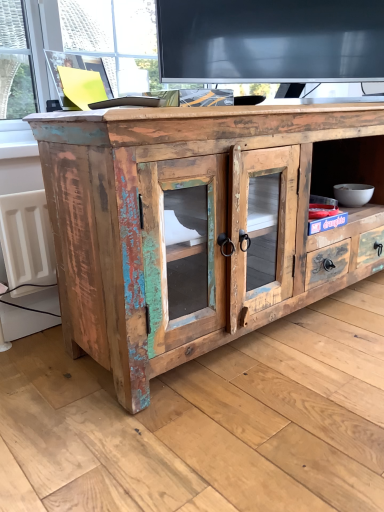
Find the location of a particular element. Image resolution: width=384 pixels, height=512 pixels. vacant area that lies in front of white plastic radiator at left is located at coordinates (24, 355).